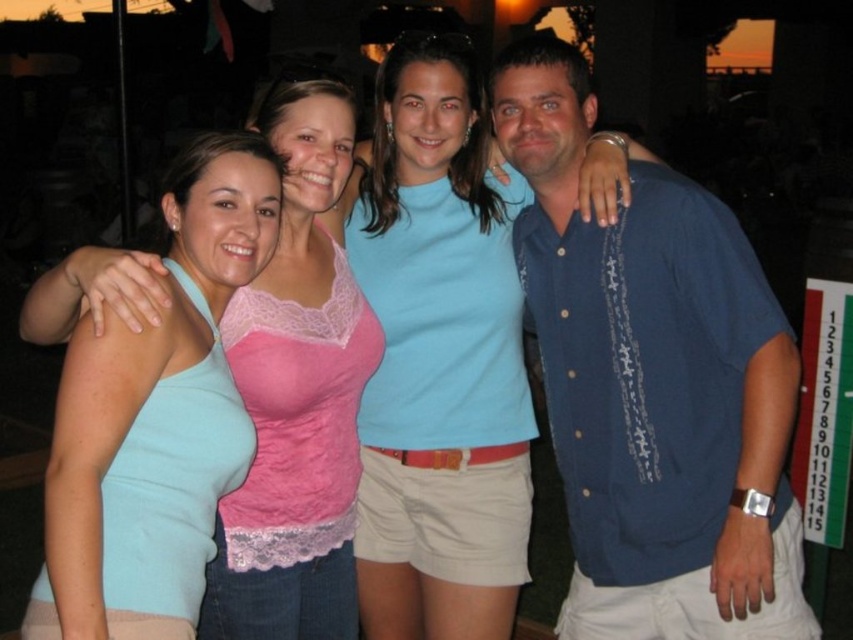
Is blue textured shirt at center to the right of light blue cotton shirt at center from the viewer's perspective?

Correct, you'll find blue textured shirt at center to the right of light blue cotton shirt at center.

Can you confirm if blue textured shirt at center is positioned below light blue cotton shirt at center?

Actually, blue textured shirt at center is above light blue cotton shirt at center.

This screenshot has width=853, height=640. Describe the element at coordinates (653, 385) in the screenshot. I see `blue textured shirt at center` at that location.

Locate an element on the screen. Image resolution: width=853 pixels, height=640 pixels. blue textured shirt at center is located at coordinates (653, 385).

How distant is light blue cotton shirt at center from light blue tank top at left?

They are 9.25 inches apart.

Consider the image. Does light blue cotton shirt at center have a smaller size compared to light blue tank top at left?

Incorrect, light blue cotton shirt at center is not smaller in size than light blue tank top at left.

Who is more forward, (407, 118) or (329, 88)?

Positioned in front is point (329, 88).

Find the location of a particular element. The width and height of the screenshot is (853, 640). light blue cotton shirt at center is located at coordinates (439, 358).

Does blue textured shirt at center have a greater height compared to light blue tank top at left?

Indeed, blue textured shirt at center has a greater height compared to light blue tank top at left.

Is point (537, 310) positioned after point (125, 272)?

Yes, point (537, 310) is farther from viewer.

The image size is (853, 640). I want to click on blue textured shirt at center, so click(x=653, y=385).